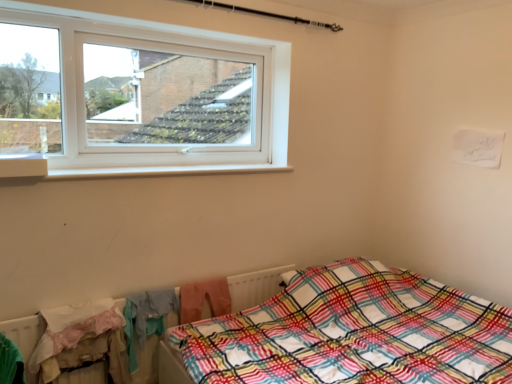
Question: Can you confirm if white textured radiator at lower left is taller than plaid fabric bed at lower right?

Choices:
 (A) no
 (B) yes

Answer: (A)

Question: Does white textured radiator at lower left have a greater width compared to plaid fabric bed at lower right?

Choices:
 (A) yes
 (B) no

Answer: (B)

Question: Is white textured radiator at lower left facing away from plaid fabric bed at lower right?

Choices:
 (A) yes
 (B) no

Answer: (B)

Question: Is white textured radiator at lower left aimed at plaid fabric bed at lower right?

Choices:
 (A) no
 (B) yes

Answer: (B)

Question: Is white textured radiator at lower left positioned in front of plaid fabric bed at lower right?

Choices:
 (A) no
 (B) yes

Answer: (A)

Question: Is white plastic window sill at upper left taller or shorter than plaid fabric bed at lower right?

Choices:
 (A) tall
 (B) short

Answer: (B)

Question: From a real-world perspective, is white plastic window sill at upper left above or below plaid fabric bed at lower right?

Choices:
 (A) above
 (B) below

Answer: (A)

Question: Is white plastic window sill at upper left spatially inside plaid fabric bed at lower right, or outside of it?

Choices:
 (A) inside
 (B) outside

Answer: (B)

Question: Would you say white plastic window sill at upper left is to the left or to the right of plaid fabric bed at lower right in the picture?

Choices:
 (A) left
 (B) right

Answer: (A)

Question: From a real-world perspective, relative to white textured radiator at lower left, is plaid fabric bed at lower right vertically above or below?

Choices:
 (A) below
 (B) above

Answer: (A)

Question: Considering the positions of plaid fabric bed at lower right and white textured radiator at lower left in the image, is plaid fabric bed at lower right bigger or smaller than white textured radiator at lower left?

Choices:
 (A) big
 (B) small

Answer: (A)

Question: In the image, is plaid fabric bed at lower right on the left side or the right side of white textured radiator at lower left?

Choices:
 (A) right
 (B) left

Answer: (A)

Question: In terms of width, does plaid fabric bed at lower right look wider or thinner when compared to white textured radiator at lower left?

Choices:
 (A) wide
 (B) thin

Answer: (A)

Question: From a real-world perspective, is white plastic window sill at upper left above or below white textured radiator at lower left?

Choices:
 (A) below
 (B) above

Answer: (B)

Question: Is white plastic window sill at upper left situated inside white textured radiator at lower left or outside?

Choices:
 (A) inside
 (B) outside

Answer: (B)